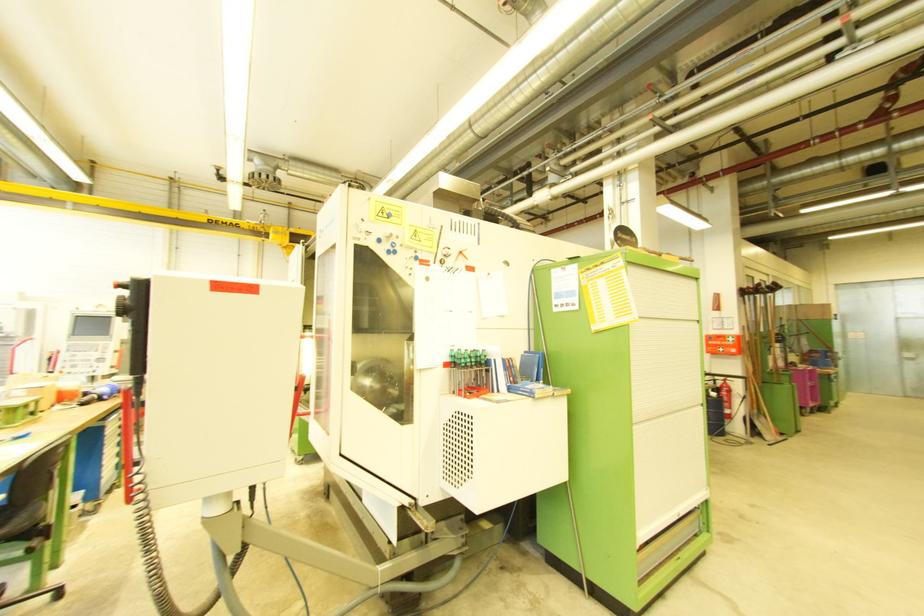
This screenshot has height=616, width=924. Describe the element at coordinates (129, 439) in the screenshot. I see `a machine door handle` at that location.